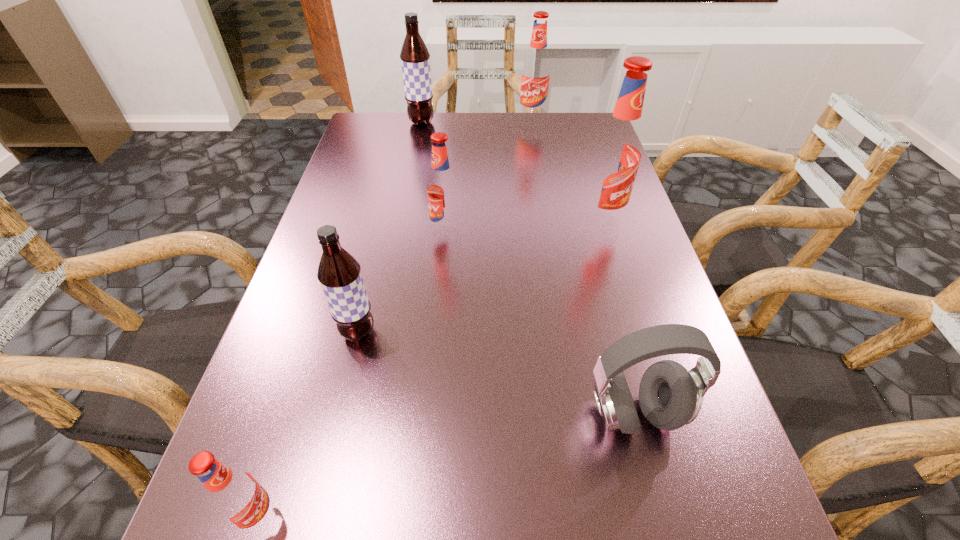
Image resolution: width=960 pixels, height=540 pixels. Identify the location of headset that is at the right edge. (670, 396).

Find the location of a particular element. The height and width of the screenshot is (540, 960). object located in the far left corner section of the desktop is located at coordinates (415, 58).

The height and width of the screenshot is (540, 960). I want to click on vacant space at the far edge of the desktop, so click(478, 134).

Identify the location of vacant space at the left edge of the desktop. (297, 286).

Find the location of a particular element. This screenshot has height=540, width=960. vacant space at the right edge is located at coordinates (617, 272).

In the image, there is a desktop. At what (x,y) coordinates should I click in order to perform the action: click on vacant space at the far left corner. Please return your answer as a coordinate pair (x, y). Looking at the image, I should click on (397, 138).

In the image, there is a desktop. Identify the location of vacant space at the far right corner. (573, 146).

This screenshot has height=540, width=960. I want to click on vacant point located between the rightmost red root beer and the second nearest object, so pos(617,318).

Image resolution: width=960 pixels, height=540 pixels. I want to click on free space between the headset and the third red root beer from right to left, so click(x=540, y=323).

You are a GUI agent. You are given a task and a screenshot of the screen. Output one action in this format:
    pyautogui.click(x=<x>, y=<y>)
    Task: Click on the vacant space that is in between the second red root beer from left to right and the third smallest red root beer
    The width and height of the screenshot is (960, 540).
    Given the screenshot: What is the action you would take?
    pyautogui.click(x=489, y=177)